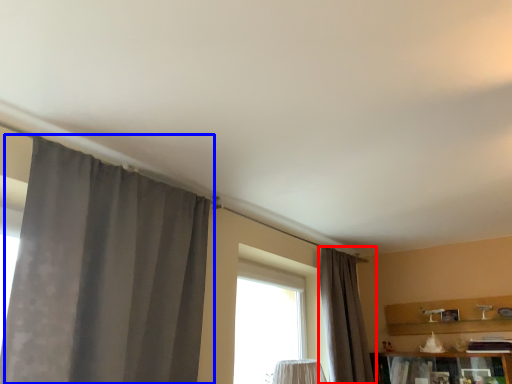
Question: Which object appears closest to the camera in this image, curtain (highlighted by a red box) or curtain (highlighted by a blue box)?

Choices:
 (A) curtain
 (B) curtain

Answer: (B)